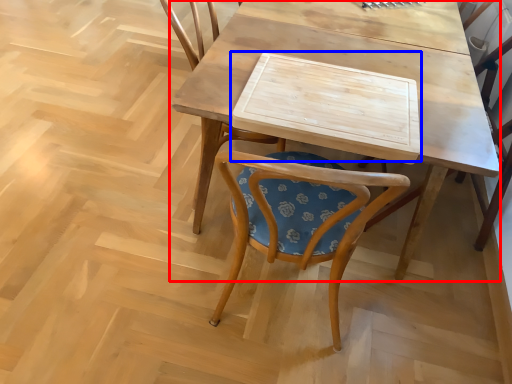
Question: Which point is further to the camera, table (highlighted by a red box) or plank (highlighted by a blue box)?

Choices:
 (A) table
 (B) plank

Answer: (B)